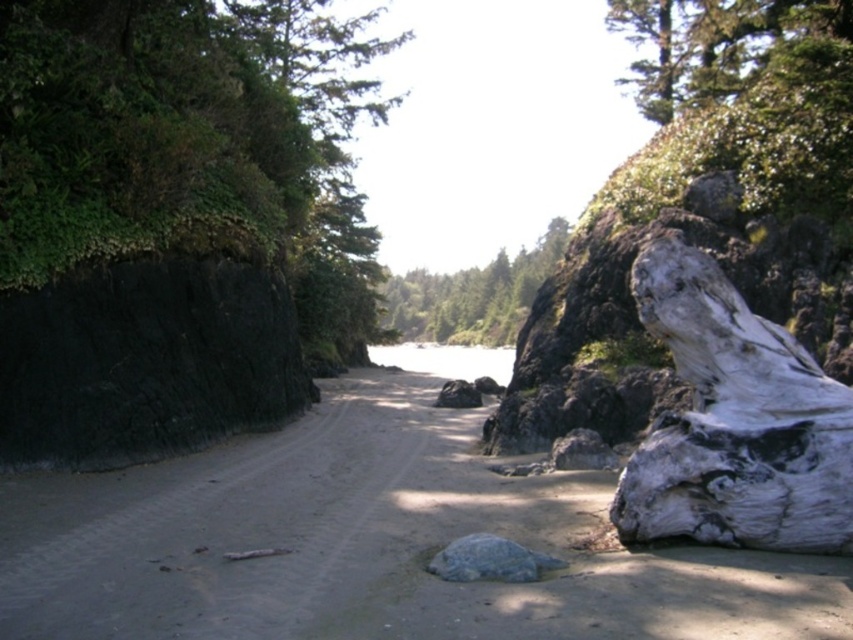
Is white weathered wood stump at right thinner than gray rock at lower right?

In fact, white weathered wood stump at right might be wider than gray rock at lower right.

Image resolution: width=853 pixels, height=640 pixels. Describe the element at coordinates (734, 422) in the screenshot. I see `white weathered wood stump at right` at that location.

Find the location of a particular element. white weathered wood stump at right is located at coordinates (734, 422).

Can you confirm if gray smooth rock at center is positioned below gray rock at lower right?

Answer: Yes.

Can you confirm if gray smooth rock at center is smaller than gray rock at lower right?

Indeed, gray smooth rock at center has a smaller size compared to gray rock at lower right.

You are a GUI agent. You are given a task and a screenshot of the screen. Output one action in this format:
    pyautogui.click(x=<x>, y=<y>)
    Task: Click on the gray smooth rock at center
    The width and height of the screenshot is (853, 640).
    Given the screenshot: What is the action you would take?
    pyautogui.click(x=489, y=561)

Between point (641, 20) and point (422, 326), which one is positioned behind?

Positioned behind is point (422, 326).

Is point (753, 28) positioned in front of point (543, 257)?

That is True.

The image size is (853, 640). What do you see at coordinates (712, 44) in the screenshot?
I see `green leafy tree at upper center` at bounding box center [712, 44].

I want to click on green leafy tree at upper center, so [712, 44].